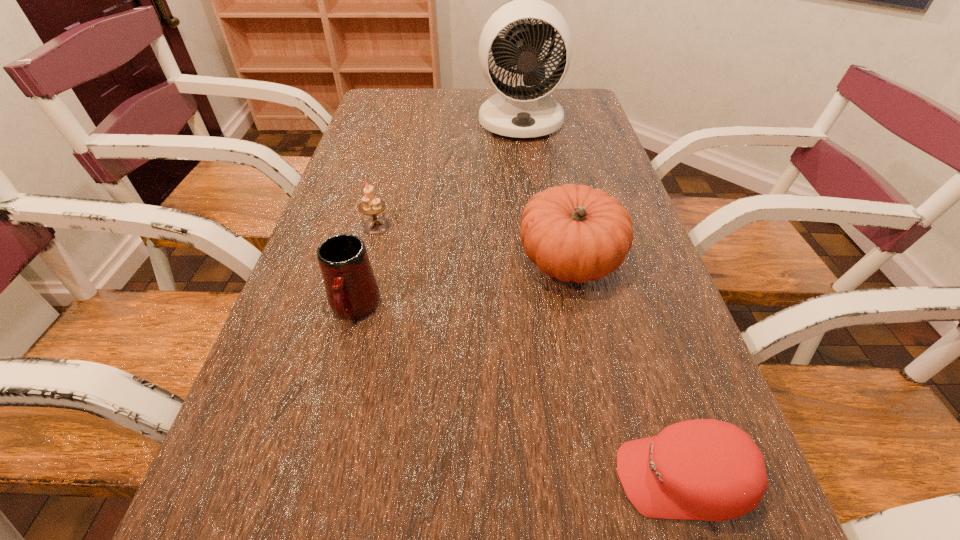
Locate an element on the screen. The image size is (960, 540). the farthest object is located at coordinates (520, 111).

The height and width of the screenshot is (540, 960). I want to click on the tallest object, so click(520, 111).

Where is `pumpkin`? This screenshot has width=960, height=540. pumpkin is located at coordinates (575, 233).

The width and height of the screenshot is (960, 540). I want to click on mug, so click(352, 291).

Locate an element on the screen. This screenshot has height=540, width=960. candle holder is located at coordinates (370, 205).

Where is `the shortest object`? the shortest object is located at coordinates (704, 469).

Where is `the nearest object`? Image resolution: width=960 pixels, height=540 pixels. the nearest object is located at coordinates (704, 469).

I want to click on free space located 0.230m on the grille of the fan, so tap(530, 186).

The width and height of the screenshot is (960, 540). Identify the location of free location located on the back of the pumpkin. (546, 150).

At what (x,y) coordinates should I click in order to perform the action: click on free region located on the side of the mug with the handle. Please return your answer as a coordinate pair (x, y). Looking at the image, I should click on (310, 477).